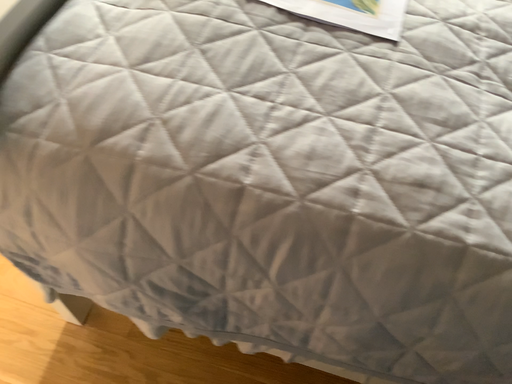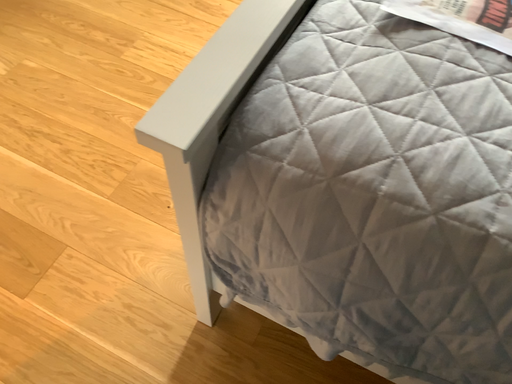
Question: How did the camera likely rotate when shooting the video?

Choices:
 (A) rotated right
 (B) rotated left

Answer: (B)